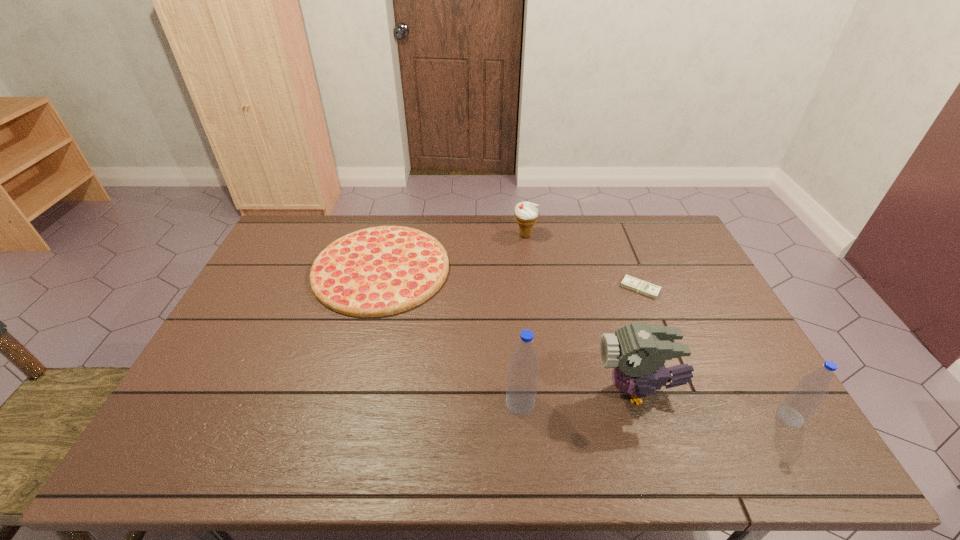
Considering the uniform spacing of water bottles, where should an additional water bottle be positioned on the left? Please locate a free spot. Please provide its 2D coordinates. Your answer should be formatted as a tuple, i.e. [(x, y)], where the tuple contains the x and y coordinates of a point satisfying the conditions above.

[(265, 388)]